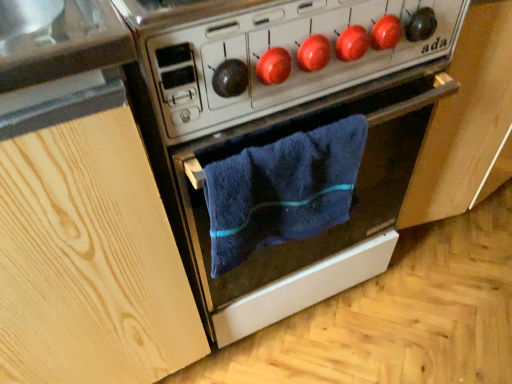
Question: Do you think metallic silver oven at center is within blue soft towel at center, or outside of it?

Choices:
 (A) inside
 (B) outside

Answer: (B)

Question: Based on their positions, is metallic silver oven at center located to the left or right of blue soft towel at center?

Choices:
 (A) right
 (B) left

Answer: (B)

Question: Estimate the real-world distances between objects in this image. Which object is closer to the blue soft towel at center?

Choices:
 (A) metallic stove at center
 (B) metallic silver oven at center
 (C) light wood cabinet at left

Answer: (B)

Question: Which is farther from the metallic silver oven at center?

Choices:
 (A) blue soft towel at center
 (B) light wood cabinet at left
 (C) metallic stove at center

Answer: (B)